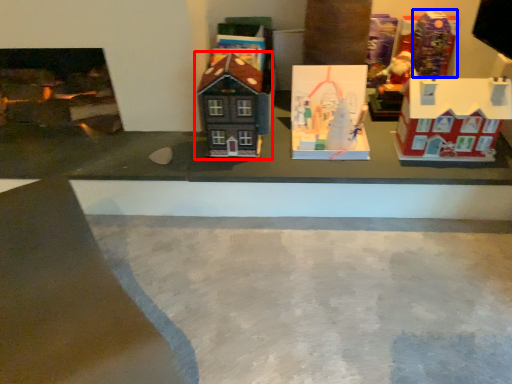
Question: Which point is closer to the camera, toy (highlighted by a red box) or toy (highlighted by a blue box)?

Choices:
 (A) toy
 (B) toy

Answer: (A)